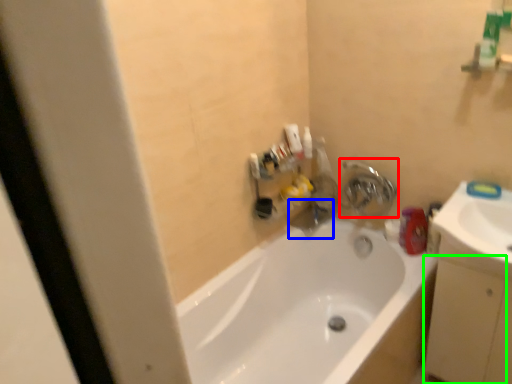
Question: Based on their relative distances, which object is nearer to tap (highlighted by a red box)? Choose from plumbing fixture (highlighted by a blue box) and drawer (highlighted by a green box).

Choices:
 (A) plumbing fixture
 (B) drawer

Answer: (A)